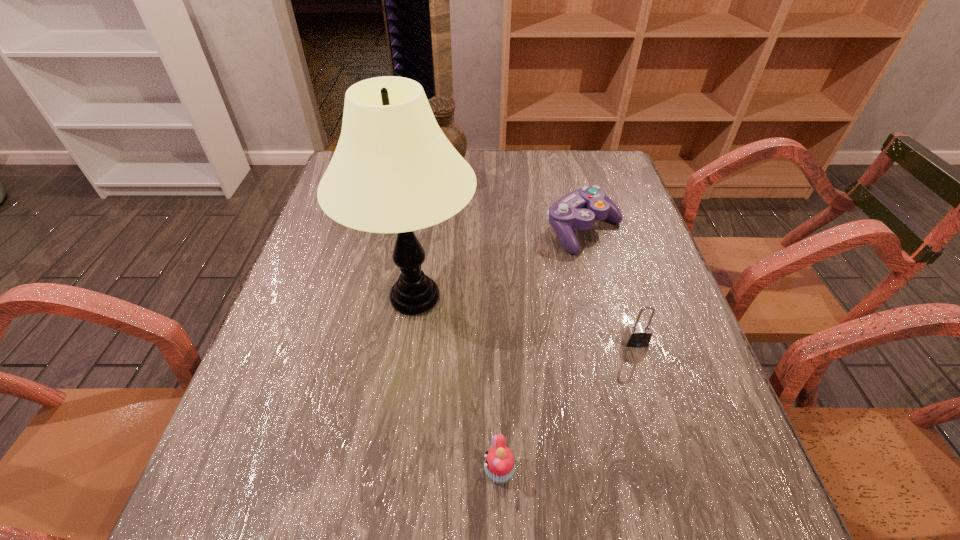
The image size is (960, 540). Identify the location of vacant space located 0.330m on the left of the control. (420, 231).

The width and height of the screenshot is (960, 540). Identify the location of vacant space positioned 0.300m on the face of the third object from left to right. (302, 471).

Find the location of `vacant space situated on the face of the third object from left to right`. vacant space situated on the face of the third object from left to right is located at coordinates (284, 471).

In order to click on vacant space located 0.070m on the face of the third object from left to right in this screenshot , I will do `click(442, 471)`.

Locate an element on the screen. The image size is (960, 540). object present at the far edge is located at coordinates (443, 107).

At what (x,y) coordinates should I click in order to perform the action: click on object located at the near edge. Please return your answer as a coordinate pair (x, y). This screenshot has width=960, height=540. Looking at the image, I should click on (499, 465).

At what (x,y) coordinates should I click in order to perform the action: click on object situated at the left edge. Please return your answer as a coordinate pair (x, y). Looking at the image, I should click on (393, 171).

You are a GUI agent. You are given a task and a screenshot of the screen. Output one action in this format:
    pyautogui.click(x=<x>, y=<y>)
    Task: Click on the padlock that is at the right edge
    
    Given the screenshot: What is the action you would take?
    pyautogui.click(x=636, y=335)

The image size is (960, 540). I want to click on control present at the right edge, so click(579, 209).

Image resolution: width=960 pixels, height=540 pixels. In the image, there is a desktop. Identify the location of free space at the near edge. (392, 503).